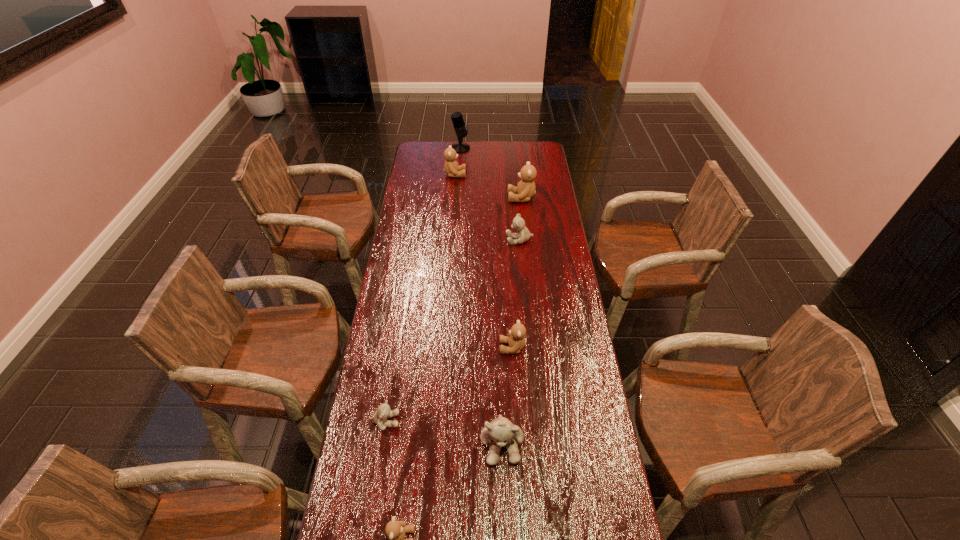
Where is `the fifth nearest teddy bear`? the fifth nearest teddy bear is located at coordinates (523, 235).

Locate an element on the screen. The width and height of the screenshot is (960, 540). the leftmost teddy bear is located at coordinates (383, 412).

Locate an element on the screen. This screenshot has height=540, width=960. the leftmost object is located at coordinates (383, 412).

Image resolution: width=960 pixels, height=540 pixels. I want to click on vacant space located 0.090m on the stand of the microphone, so click(x=486, y=148).

Image resolution: width=960 pixels, height=540 pixels. In order to click on vacant region located on the front-facing side of the sixth nearest object in this screenshot , I will do `click(456, 198)`.

The width and height of the screenshot is (960, 540). I want to click on free spot located 0.160m on the front-facing side of the sixth nearest object, so 475,198.

You are a GUI agent. You are given a task and a screenshot of the screen. Output one action in this format:
    pyautogui.click(x=<x>, y=<y>)
    Task: Click on the free space located 0.360m on the front-facing side of the sixth nearest object
    The height and width of the screenshot is (540, 960).
    Given the screenshot: What is the action you would take?
    pyautogui.click(x=434, y=198)

Identify the location of vacant space located 0.150m on the front-facing side of the second farthest object. The height and width of the screenshot is (540, 960). (494, 174).

Locate an element on the screen. Image resolution: width=960 pixels, height=540 pixels. free space located on the face of the biggest gray teddy bear is located at coordinates (504, 495).

You are a GUI agent. You are given a task and a screenshot of the screen. Output one action in this format:
    pyautogui.click(x=<x>, y=<y>)
    Task: Click on the free space located on the front-facing side of the third biggest brown teddy bear
    The image size is (960, 540).
    Given the screenshot: What is the action you would take?
    pyautogui.click(x=473, y=348)